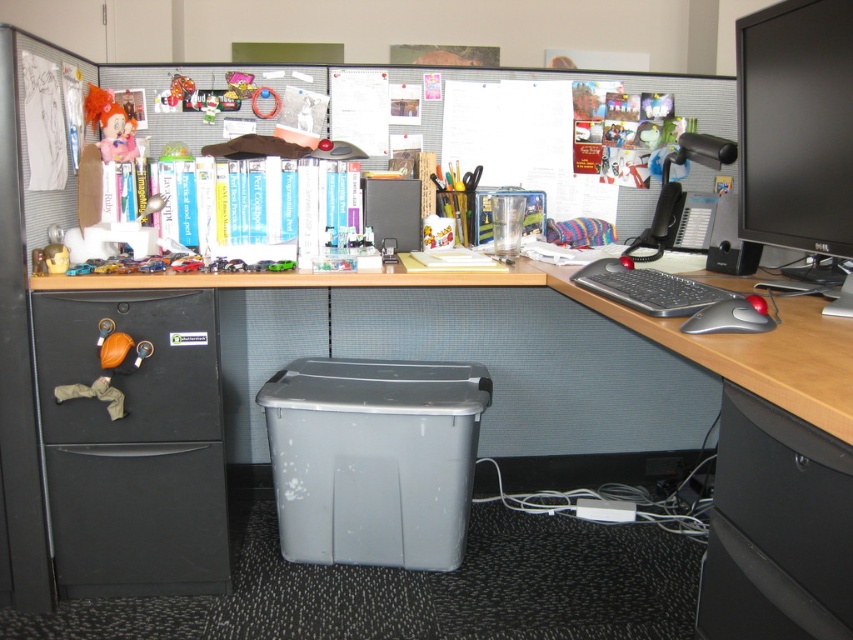
Is point (62, 380) closer to viewer compared to point (792, 310)?

That is False.

Does point (175, 348) come behind point (579, 292)?

Yes, it is behind point (579, 292).

Is point (53, 358) more distant than point (659, 336)?

That is True.

Find the location of a particular element. This screenshot has width=853, height=640. black matte drawer at lower left is located at coordinates (129, 365).

Who is more distant from viewer, (164, 586) or (755, 300)?

The point (164, 586) is more distant.

Is black matte/file cabinet at left further to camera compared to rubberized black trackball at lower right?

Yes, it is.

Where is `black matte/file cabinet at left`? black matte/file cabinet at left is located at coordinates (132, 445).

Which of these two, black matte drawer at lower left or matte pink plush at upper left, stands shorter?

With less height is matte pink plush at upper left.

This screenshot has width=853, height=640. In order to click on black matte drawer at lower left in this screenshot , I will do `click(129, 365)`.

Where is `black matte drawer at lower left`? black matte drawer at lower left is located at coordinates (129, 365).